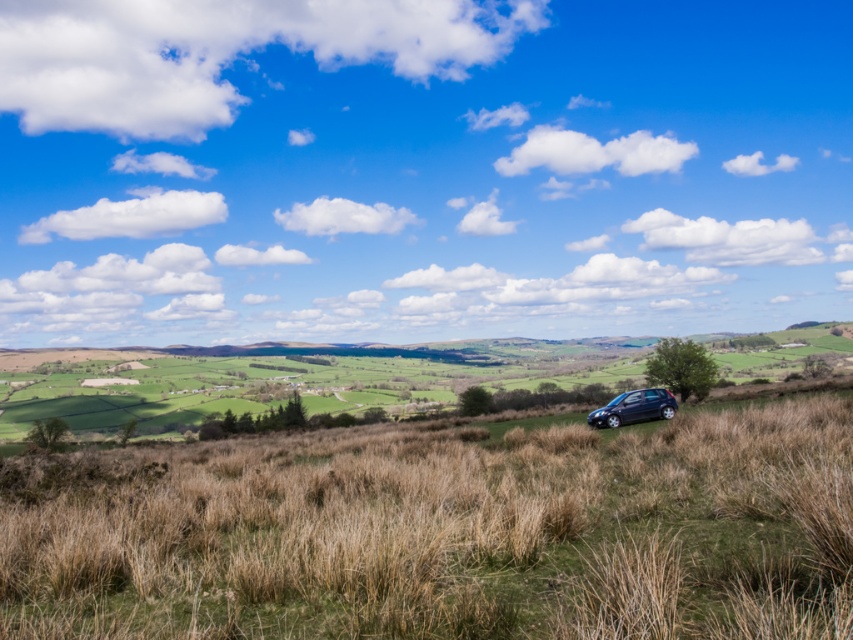
Question: Which object is farther from the camera taking this photo?

Choices:
 (A) glossy metallic car at lower right
 (B) dry grass at lower right

Answer: (A)

Question: Which point is farther to the camera?

Choices:
 (A) dry grass at lower right
 (B) glossy metallic car at lower right

Answer: (B)

Question: Which of the following is the closest to the observer?

Choices:
 (A) (664, 401)
 (B) (717, 452)

Answer: (B)

Question: Is dry grass at lower right behind glossy metallic car at lower right?

Choices:
 (A) yes
 (B) no

Answer: (B)

Question: Does dry grass at lower right have a lesser width compared to glossy metallic car at lower right?

Choices:
 (A) yes
 (B) no

Answer: (B)

Question: Is dry grass at lower right smaller than glossy metallic car at lower right?

Choices:
 (A) no
 (B) yes

Answer: (A)